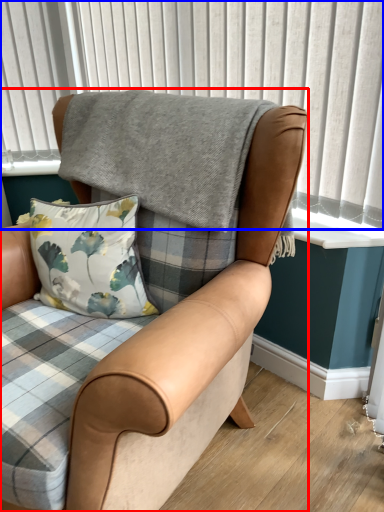
Question: Among these objects, which one is farthest to the camera, chair (highlighted by a red box) or window frame (highlighted by a blue box)?

Choices:
 (A) chair
 (B) window frame

Answer: (B)